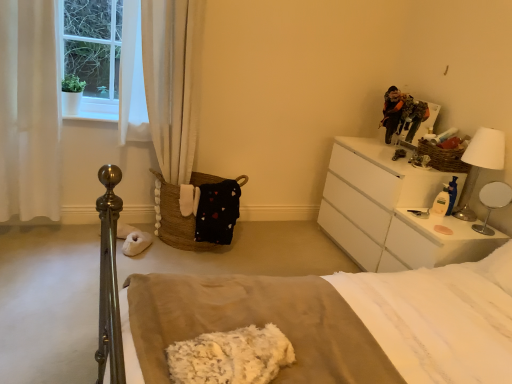
The image size is (512, 384). I want to click on white fabric curtain at left, which is the second curtain from left to right, so click(173, 81).

This screenshot has height=384, width=512. Describe the element at coordinates (392, 111) in the screenshot. I see `camouflage jacket at upper right` at that location.

Locate an element on the screen. Image resolution: width=512 pixels, height=384 pixels. white fabric curtain at left, which is counted as the 2th curtain, starting from the right is located at coordinates (29, 111).

Locate an element on the screen. This screenshot has height=384, width=512. woven brown basket at upper right, which is counted as the 1th basket, starting from the top is located at coordinates (443, 157).

Locate an element on the screen. white glossy nightstand at upper right is located at coordinates (392, 211).

I want to click on white fabric curtain at left, which is counted as the first curtain, starting from the right, so click(173, 81).

Between point (481, 197) and point (384, 119), which one is positioned behind?

Positioned behind is point (384, 119).

From a real-world perspective, which is physically below, white glossy table lamp at right, placed as the second table lamp when sorted from top to bottom, or camouflage jacket at upper right?

white glossy table lamp at right, placed as the second table lamp when sorted from top to bottom, is physically lower.

Could camouflage jacket at upper right be considered to be inside white glossy table lamp at right, placed as the second table lamp when sorted from top to bottom?

No, camouflage jacket at upper right is located outside of white glossy table lamp at right, placed as the second table lamp when sorted from top to bottom.

Based on the photo, considering the relative sizes of white glossy table lamp at right, the 1th table lamp ordered from the bottom, and camouflage jacket at upper right in the image provided, is white glossy table lamp at right, the 1th table lamp ordered from the bottom, taller than camouflage jacket at upper right?

No, white glossy table lamp at right, the 1th table lamp ordered from the bottom, is not taller than camouflage jacket at upper right.

Which is more to the left, white fabric curtain at left, which is the second curtain from left to right, or camouflage jacket at upper right?

white fabric curtain at left, which is the second curtain from left to right.

Considering the positions of point (159, 164) and point (398, 111), is point (159, 164) closer or farther from the camera than point (398, 111)?

Point (159, 164) is positioned closer to the camera compared to point (398, 111).

Is white fabric curtain at left, which is the second curtain from left to right, beside camouflage jacket at upper right?

No, white fabric curtain at left, which is the second curtain from left to right, is not touching camouflage jacket at upper right.

Based on their positions, is brown woven basket at lower left, positioned as the 2th basket in right-to-left order, located to the left or right of white fluffy blanket at center?

Based on their positions, brown woven basket at lower left, positioned as the 2th basket in right-to-left order, is located to the left of white fluffy blanket at center.

From the image's perspective, is brown woven basket at lower left, positioned as the 2th basket in right-to-left order, located above white fluffy blanket at center?

Yes, from the image's perspective, brown woven basket at lower left, positioned as the 2th basket in right-to-left order, is on top of white fluffy blanket at center.

Looking at their sizes, would you say brown woven basket at lower left, the 1th basket viewed from the left, is wider or thinner than white fluffy blanket at center?

Clearly, brown woven basket at lower left, the 1th basket viewed from the left, has less width compared to white fluffy blanket at center.

Based on the photo, does brown woven basket at lower left, positioned as the 2th basket in right-to-left order, turn towards woven brown basket at upper right, which is counted as the 1th basket, starting from the top?

No, brown woven basket at lower left, positioned as the 2th basket in right-to-left order, is not facing towards woven brown basket at upper right, which is counted as the 1th basket, starting from the top.

Considering the relative sizes of brown woven basket at lower left, positioned as the first basket in bottom-to-top order, and woven brown basket at upper right, marked as the 2th basket in a left-to-right arrangement, in the image provided, is brown woven basket at lower left, positioned as the first basket in bottom-to-top order, smaller than woven brown basket at upper right, marked as the 2th basket in a left-to-right arrangement,?

Incorrect, brown woven basket at lower left, positioned as the first basket in bottom-to-top order, is not smaller in size than woven brown basket at upper right, marked as the 2th basket in a left-to-right arrangement.

Considering the positions of objects brown woven basket at lower left, the 1th basket viewed from the left, and woven brown basket at upper right, which ranks as the second basket in bottom-to-top order, in the image provided, who is behind, brown woven basket at lower left, the 1th basket viewed from the left, or woven brown basket at upper right, which ranks as the second basket in bottom-to-top order,?

brown woven basket at lower left, the 1th basket viewed from the left, is further from the camera.

Considering the positions of objects brown woven basket at lower left, the 2th basket in the top-to-bottom sequence, and woven brown basket at upper right, marked as the 2th basket in a left-to-right arrangement, in the image provided, who is more to the right, brown woven basket at lower left, the 2th basket in the top-to-bottom sequence, or woven brown basket at upper right, marked as the 2th basket in a left-to-right arrangement,?

woven brown basket at upper right, marked as the 2th basket in a left-to-right arrangement.

Considering the positions of objects brown woven basket at lower left, the 1th basket viewed from the left, and beige cotton bed at center in the image provided, who is more to the right, brown woven basket at lower left, the 1th basket viewed from the left, or beige cotton bed at center?

From the viewer's perspective, beige cotton bed at center appears more on the right side.

From a real-world perspective, does brown woven basket at lower left, positioned as the first basket in bottom-to-top order, sit lower than beige cotton bed at center?

Incorrect, from a real-world perspective, brown woven basket at lower left, positioned as the first basket in bottom-to-top order, is higher than beige cotton bed at center.

This screenshot has width=512, height=384. Identify the location of bed located on the right of brown woven basket at lower left, positioned as the first basket in bottom-to-top order. (339, 322).

From the image's perspective, would you say white glossy table lamp at right, placed as the second table lamp when sorted from top to bottom, is positioned over brown woven basket at lower left, the 1th basket viewed from the left?

No, from the image's perspective, white glossy table lamp at right, placed as the second table lamp when sorted from top to bottom, is not over brown woven basket at lower left, the 1th basket viewed from the left.

Considering the relative positions of white glossy table lamp at right, the 1th table lamp ordered from the bottom, and brown woven basket at lower left, positioned as the first basket in bottom-to-top order, in the image provided, is white glossy table lamp at right, the 1th table lamp ordered from the bottom, to the right of brown woven basket at lower left, positioned as the first basket in bottom-to-top order, from the viewer's perspective?

Indeed, white glossy table lamp at right, the 1th table lamp ordered from the bottom, is positioned on the right side of brown woven basket at lower left, positioned as the first basket in bottom-to-top order.

From a real-world perspective, is white glossy table lamp at right, placed as the second table lamp when sorted from top to bottom, over brown woven basket at lower left, positioned as the 2th basket in right-to-left order?

Yes, from a real-world perspective, white glossy table lamp at right, placed as the second table lamp when sorted from top to bottom, is above brown woven basket at lower left, positioned as the 2th basket in right-to-left order.

Which object is further away from the camera taking this photo, white glossy table lamp at right, placed as the second table lamp when sorted from top to bottom, or brown woven basket at lower left, positioned as the first basket in bottom-to-top order?

brown woven basket at lower left, positioned as the first basket in bottom-to-top order, is further from the camera.

Measure the distance between brown woven basket at lower left, the 1th basket viewed from the left, and white glossy nightstand at upper right.

A distance of 3.66 feet exists between brown woven basket at lower left, the 1th basket viewed from the left, and white glossy nightstand at upper right.

Between brown woven basket at lower left, positioned as the 2th basket in right-to-left order, and white glossy nightstand at upper right, which one appears on the right side from the viewer's perspective?

Positioned to the right is white glossy nightstand at upper right.

Considering the sizes of objects brown woven basket at lower left, the 2th basket in the top-to-bottom sequence, and white glossy nightstand at upper right in the image provided, who is bigger, brown woven basket at lower left, the 2th basket in the top-to-bottom sequence, or white glossy nightstand at upper right?

white glossy nightstand at upper right is bigger.

Between brown woven basket at lower left, the 1th basket viewed from the left, and white glossy nightstand at upper right, which one has less height?

Standing shorter between the two is brown woven basket at lower left, the 1th basket viewed from the left.

Identify the location of the 2nd table lamp in front of the camouflage jacket at upper right. Image resolution: width=512 pixels, height=384 pixels. (492, 202).

Find the location of a particular element. This screenshot has height=384, width=512. person on the right of the white fabric curtain at left, which is the second curtain from left to right is located at coordinates (392, 111).

Based on their spatial positions, is white glossy table lamp at right, placed as the second table lamp when sorted from top to bottom, or white fabric curtain at left, which is counted as the 2th curtain, starting from the right, closer to white fabric curtain at left, which is the second curtain from left to right?

The object closer to white fabric curtain at left, which is the second curtain from left to right, is white fabric curtain at left, which is counted as the 2th curtain, starting from the right.

Based on their spatial positions, is camouflage jacket at upper right or white metallic table lamp at upper right, the 1th table lamp when ordered from top to bottom, further from white fabric curtain at left, which is counted as the first curtain, starting from the left?

white metallic table lamp at upper right, the 1th table lamp when ordered from top to bottom.

Which object lies nearer to the anchor point white fluffy blanket at center, brown woven basket at lower left, positioned as the 2th basket in right-to-left order, or white metallic table lamp at upper right, the 1th table lamp when ordered from top to bottom?

The object closer to white fluffy blanket at center is brown woven basket at lower left, positioned as the 2th basket in right-to-left order.

Which object lies nearer to the anchor point woven brown basket at upper right, which is counted as the 1th basket, starting from the top, white metallic table lamp at upper right, the 1th table lamp when ordered from top to bottom, or white glossy table lamp at right, placed as the second table lamp when sorted from top to bottom?

Among the two, white metallic table lamp at upper right, the 1th table lamp when ordered from top to bottom, is located nearer to woven brown basket at upper right, which is counted as the 1th basket, starting from the top.

Looking at the image, which one is located closer to woven brown basket at upper right, placed as the 1th basket when sorted from right to left, white fabric curtain at left, which is counted as the first curtain, starting from the right, or white fluffy blanket at center?

white fabric curtain at left, which is counted as the first curtain, starting from the right.

From the image, which object appears to be farther from camouflage jacket at upper right, beige cotton bed at center or woven brown basket at upper right, placed as the 1th basket when sorted from right to left?

beige cotton bed at center lies further to camouflage jacket at upper right than the other object.

When comparing their distances from white fabric curtain at left, which is counted as the first curtain, starting from the right, does white fluffy blanket at center or camouflage jacket at upper right seem closer?

The object closer to white fabric curtain at left, which is counted as the first curtain, starting from the right, is camouflage jacket at upper right.

When comparing their distances from white fabric curtain at left, which is the second curtain from left to right, does white metallic table lamp at upper right, the 1th table lamp when ordered from top to bottom, or camouflage jacket at upper right seem closer?

camouflage jacket at upper right lies closer to white fabric curtain at left, which is the second curtain from left to right, than the other object.

Locate an element on the screen. material between white fabric curtain at left, which is counted as the 2th curtain, starting from the right, and woven brown basket at upper right, marked as the 2th basket in a left-to-right arrangement, in the horizontal direction is located at coordinates (231, 356).

Where is `bed between brown woven basket at lower left, positioned as the first basket in bottom-to-top order, and white glossy nightstand at upper right from left to right`? The height and width of the screenshot is (384, 512). bed between brown woven basket at lower left, positioned as the first basket in bottom-to-top order, and white glossy nightstand at upper right from left to right is located at coordinates (339, 322).

Where is `curtain between white fabric curtain at left, which is counted as the first curtain, starting from the left, and camouflage jacket at upper right`? This screenshot has width=512, height=384. curtain between white fabric curtain at left, which is counted as the first curtain, starting from the left, and camouflage jacket at upper right is located at coordinates (173, 81).

Identify the location of bed between white fabric curtain at left, which is counted as the 2th curtain, starting from the right, and white fluffy blanket at center, in the horizontal direction. (339, 322).